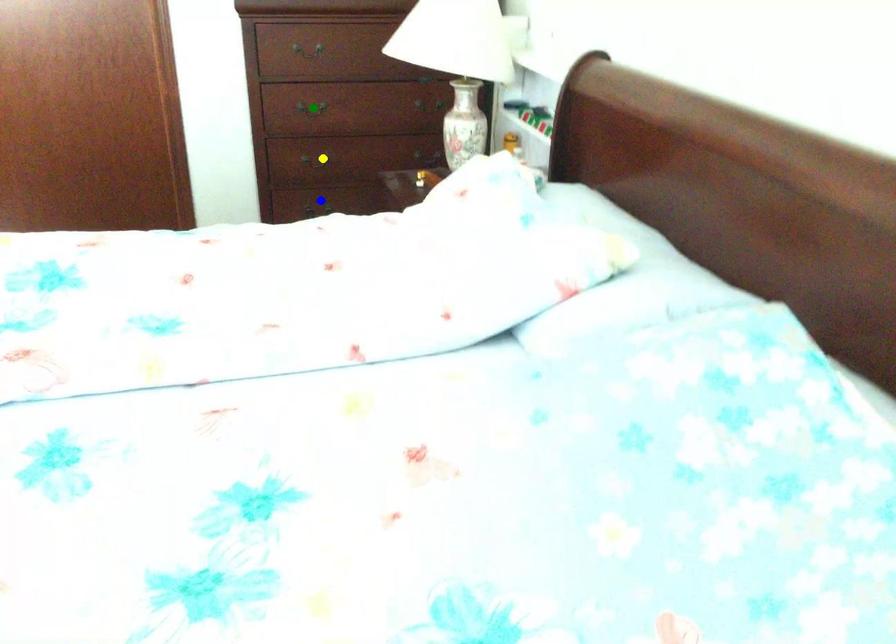
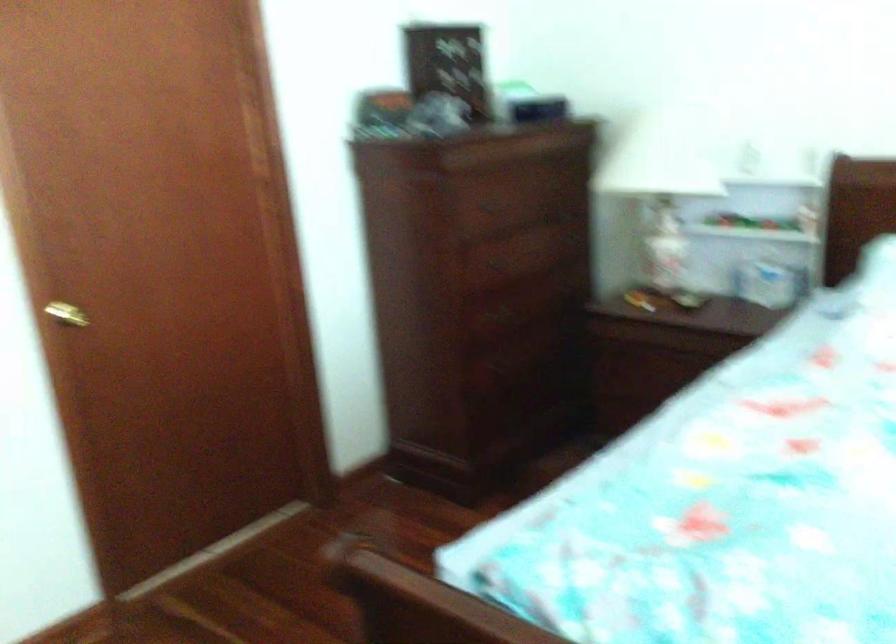
I am providing you with two images of the same scene from different viewpoints. Three points are marked in image1. Which point corresponds to a part or object that is occluded in image2?In image1, three points are marked. Which of them correspond to a part or object that is occluded in image2?Among the three points shown in image1, which one corresponds to a part or object that is no longer visible due to occlusion in image2?

green point, blue point, yellow point